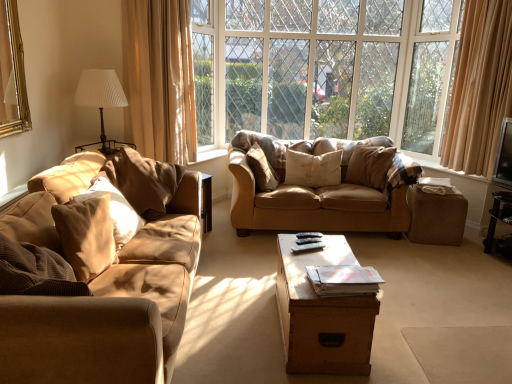
Locate an element on the screen. The image size is (512, 384). free point in front of suede beige couch at center is located at coordinates (367, 263).